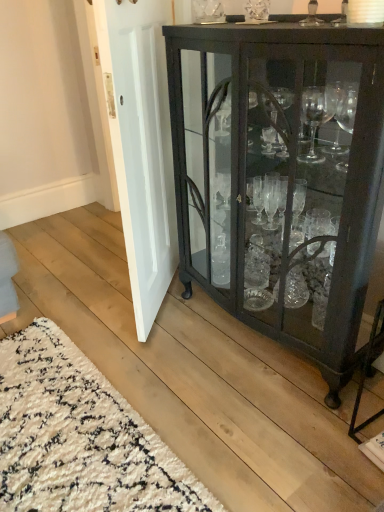
Where is `free location to the left of matte black cabinet at right`? The image size is (384, 512). free location to the left of matte black cabinet at right is located at coordinates (148, 344).